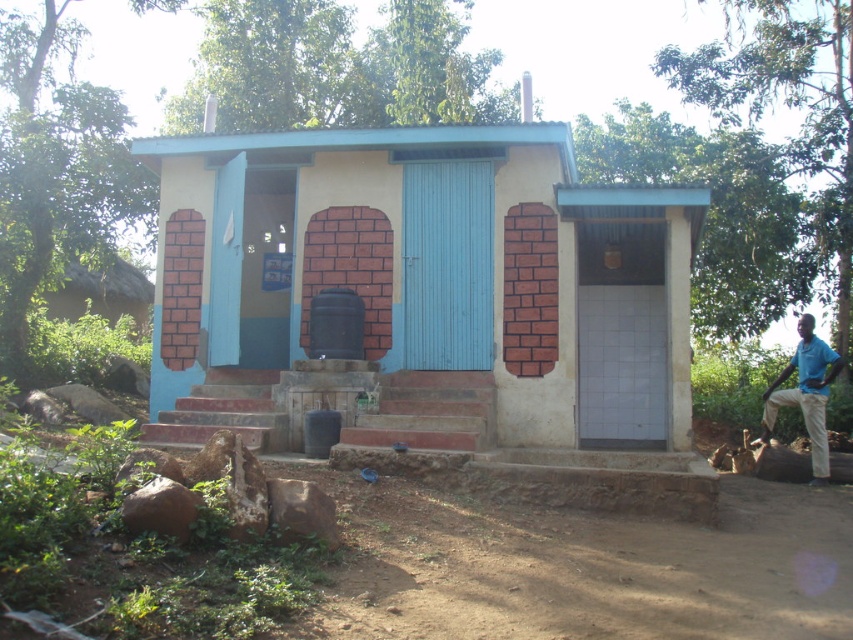
You are standing in front of the small building and want to enter through the matte blue door at center. Based on the coordinates provided, is this door centrally positioned on the building?

Yes, the matte blue door at center is centrally positioned because its coordinates are at approximately 0.480 on the x and 0.509 on the y axis, which are close to the center point of the building.

You are standing in front of the building and need to enter through either the matte blue door at center or the blue shirt at right. Which entrance is narrower?

The matte blue door at center is thinner than the blue shirt at right, so the matte blue door at center is narrower.

You are standing in front of the building and notice the matte blue door at center and the blue shirt at right. Which object is closer to you?

The matte blue door at center is closer to you because it is in front of the blue shirt at right.